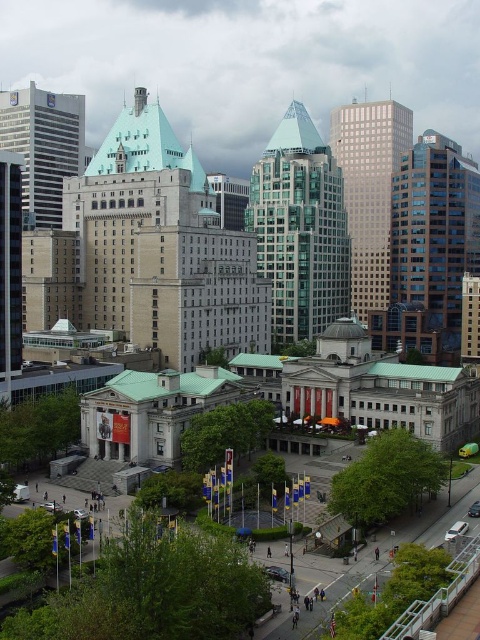
You are standing at the viewpoint of the image and want to walk from the point at coordinates point (439,179) to the point at coordinates point (11,129). Which direction should you move relative to your current position?

You should move backward because point (439,179) is in front of point (11,129), so to reach the latter, you need to go in the opposite direction.

You are an architect analyzing the urban skyline. You observe the matte silver skyscraper at left and the matte glass skyscraper at left. Which of these two skyscrapers is positioned higher in the image?

The matte silver skyscraper at left is positioned higher in the image than the matte glass skyscraper at left.